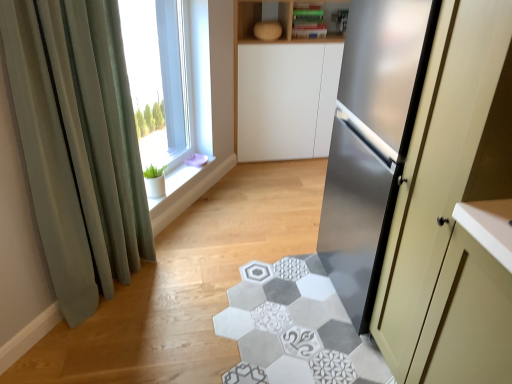
This screenshot has width=512, height=384. Find the location of `vacant space to the right of green fabric curtain at left`. vacant space to the right of green fabric curtain at left is located at coordinates (188, 291).